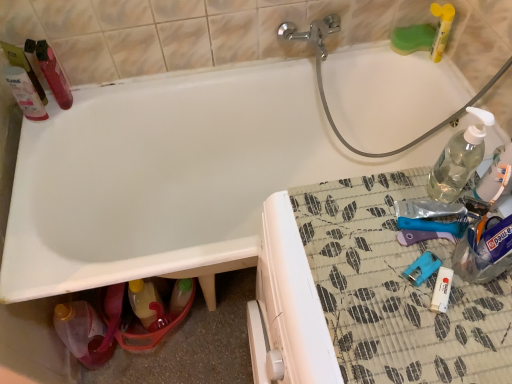
I want to click on unoccupied region to the right of translucent plastic bottles at upper left, so click(x=95, y=95).